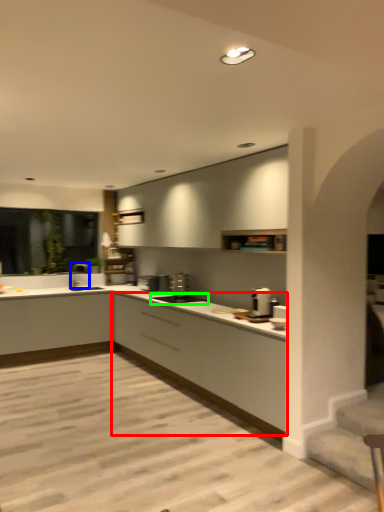
Question: Estimate the real-world distances between objects in this image. Which object is closer to cabinetry (highlighted by a red box), tap (highlighted by a blue box) or appliance (highlighted by a green box)?

Choices:
 (A) tap
 (B) appliance

Answer: (B)